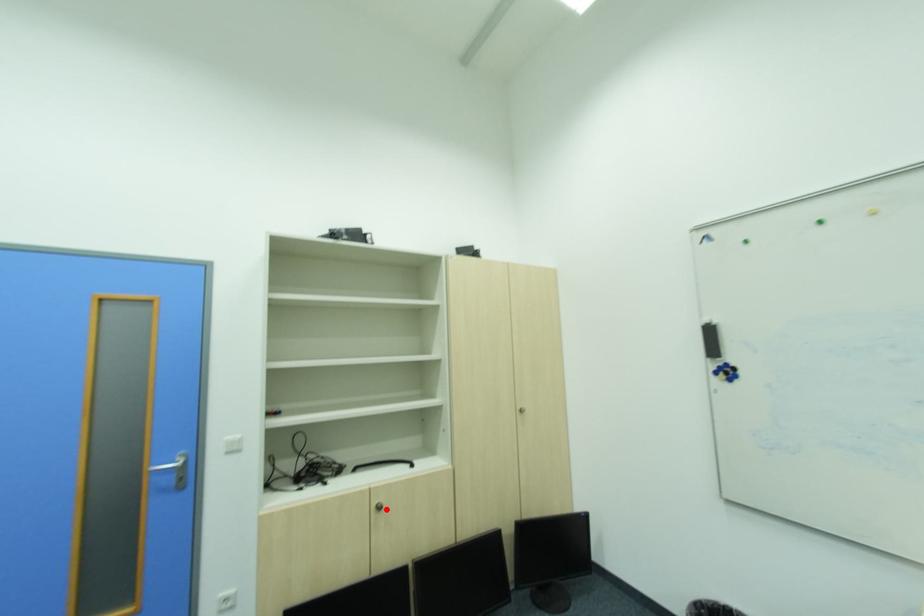
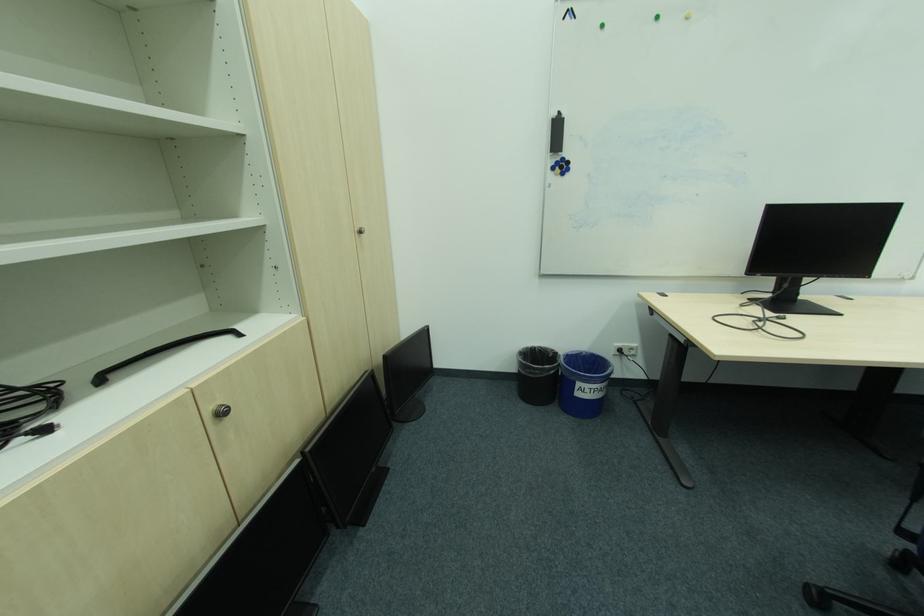
Locate, in the second image, the point that corresponds to the highlighted location in the first image.

(227, 415)